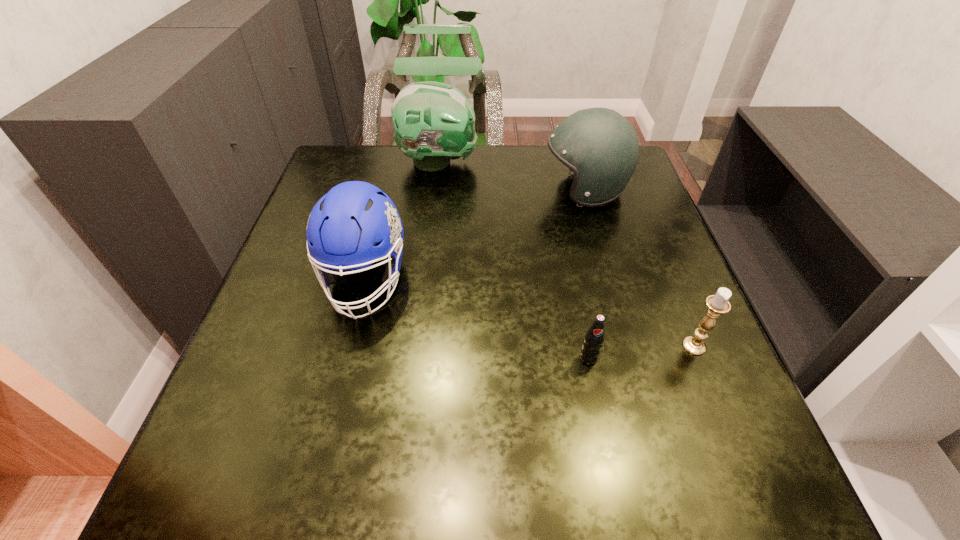
Locate an element on the screen. This screenshot has width=960, height=540. the rightmost football helmet is located at coordinates (599, 145).

At what (x,y) coordinates should I click in order to perform the action: click on the third farthest object. Please return your answer as a coordinate pair (x, y). Looking at the image, I should click on (344, 224).

Find the location of a particular element. The height and width of the screenshot is (540, 960). candle holder is located at coordinates (718, 304).

Locate an element on the screen. This screenshot has height=540, width=960. pop is located at coordinates (594, 338).

Identify the location of vacant position located 0.130m at the face opening of the rightmost football helmet. The width and height of the screenshot is (960, 540). (492, 191).

Identify the location of vacant space positioned 0.080m at the face opening of the rightmost football helmet. The width and height of the screenshot is (960, 540). (512, 191).

Find the location of a particular element. The height and width of the screenshot is (540, 960). vacant area situated 0.070m at the face opening of the rightmost football helmet is located at coordinates (516, 191).

Where is `vacant space located on the face guard of the third nearest object`? The image size is (960, 540). vacant space located on the face guard of the third nearest object is located at coordinates (335, 404).

The image size is (960, 540). Identify the location of blank space located 0.320m on the left of the candle holder. (511, 346).

This screenshot has height=540, width=960. Find the location of `free space located 0.090m on the front label of the pop`. free space located 0.090m on the front label of the pop is located at coordinates (600, 412).